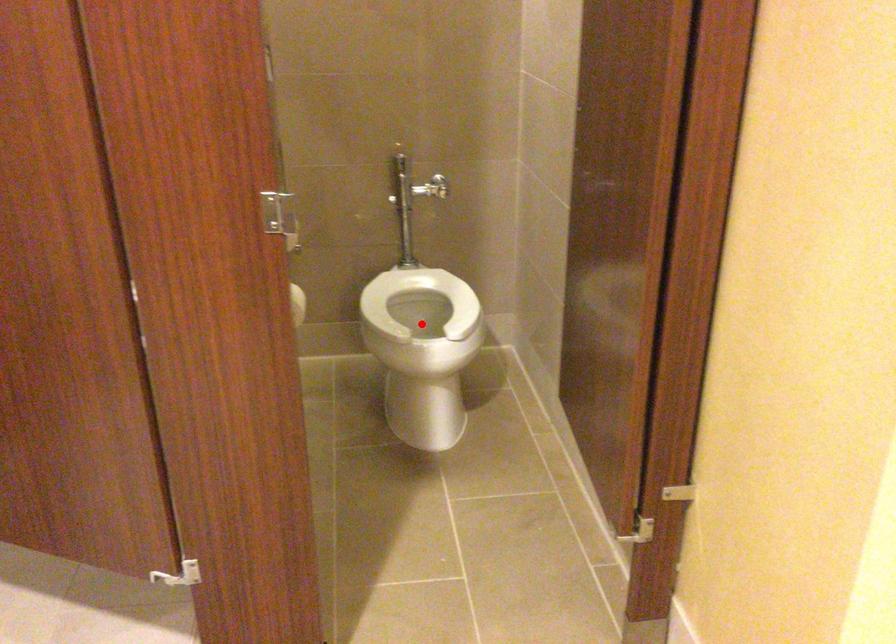
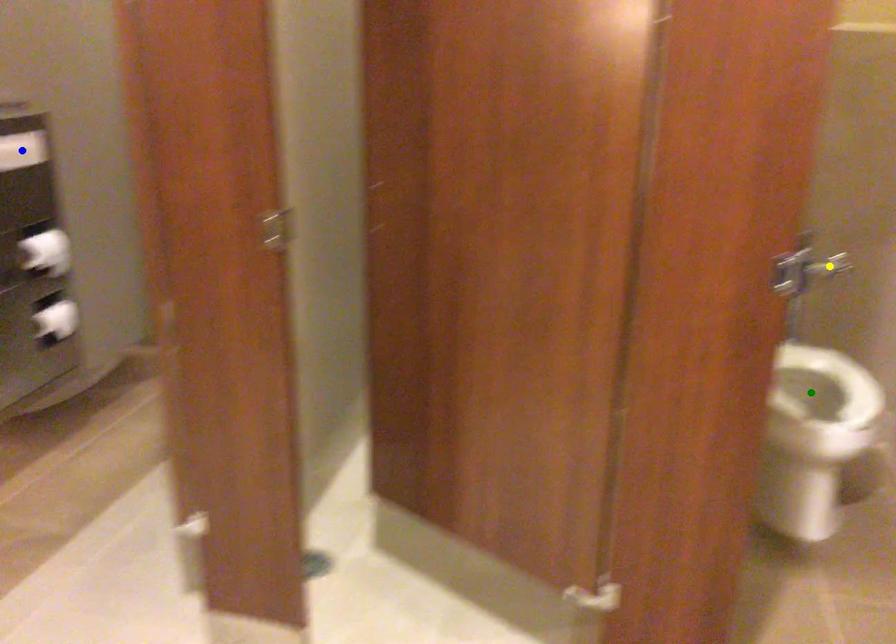
Question: I am providing you with two images of the same scene from different viewpoints. A red point is marked on the first image. You are given multiple points on the second image. In image 2, which mark is for the same physical point as the one in image 1?

Choices:
 (A) green point
 (B) yellow point
 (C) blue point

Answer: (A)